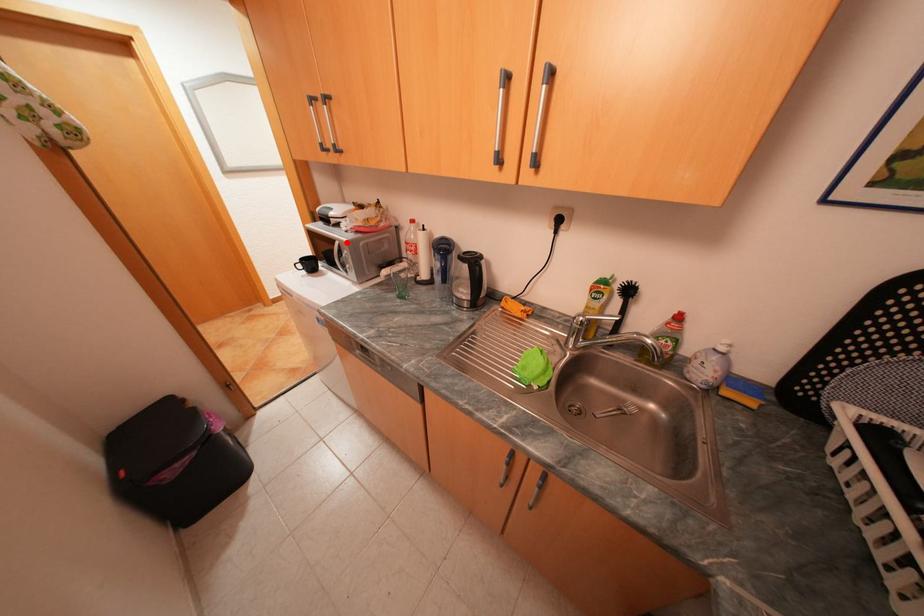
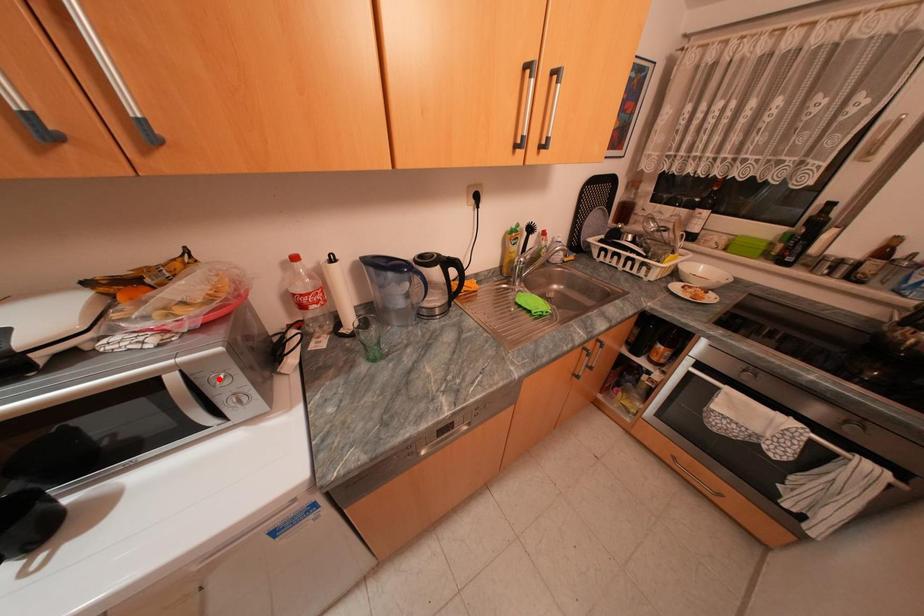
In the scene shown: I am providing you with two images of the same scene from different viewpoints. A red point is marked on the first image and another point is marked on the second image. Is the red point in image1 aligned with the point shown in image2?

No